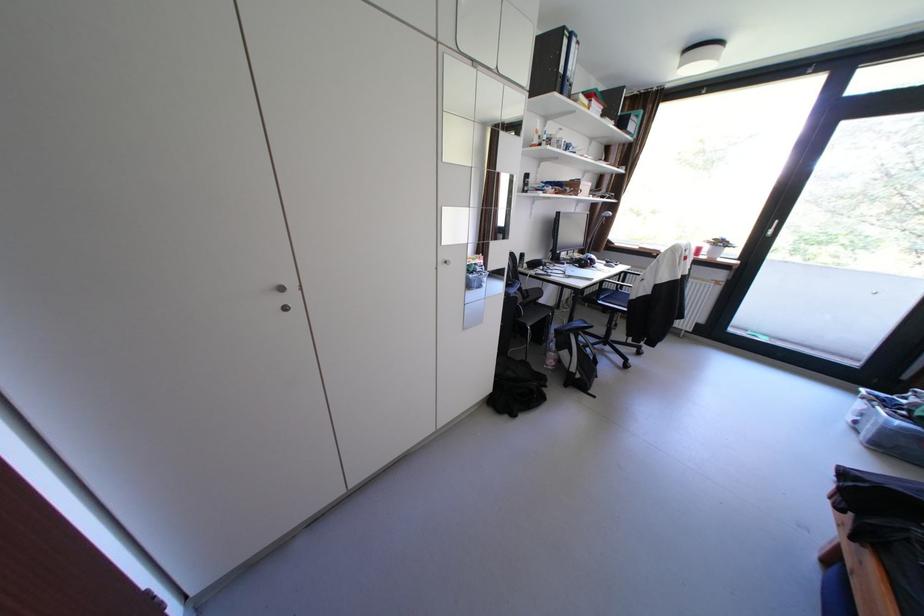
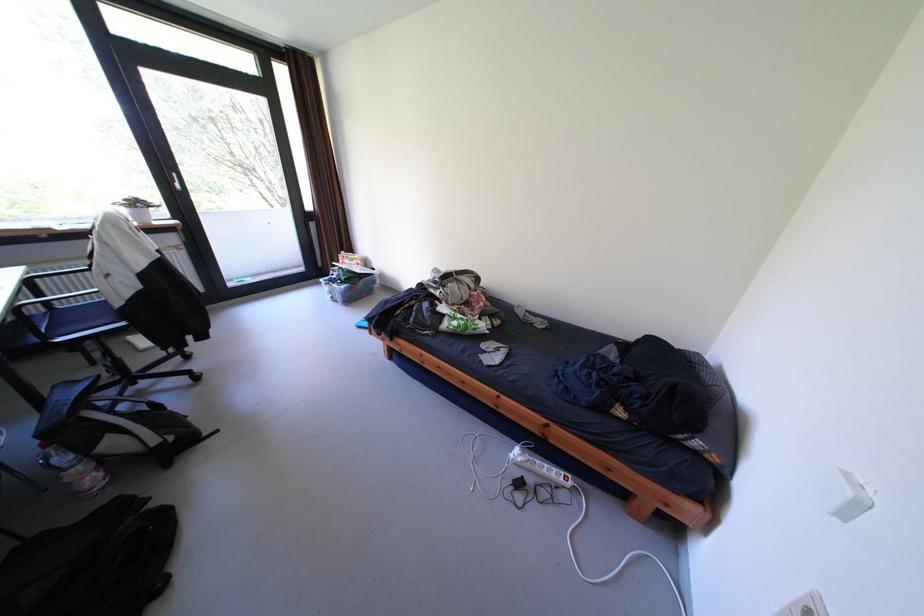
The point at (558, 363) is marked in the first image. Where is the corresponding point in the second image?

(99, 485)